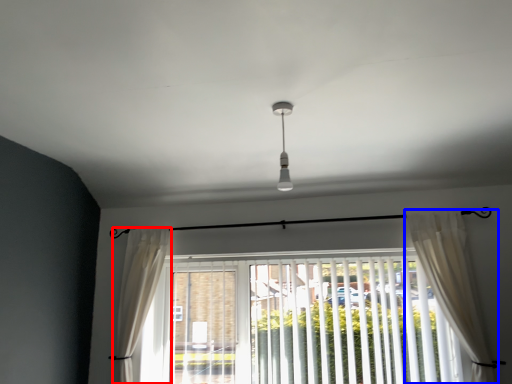
Question: Which point is closer to the camera, curtain (highlighted by a red box) or curtain (highlighted by a blue box)?

Choices:
 (A) curtain
 (B) curtain

Answer: (B)